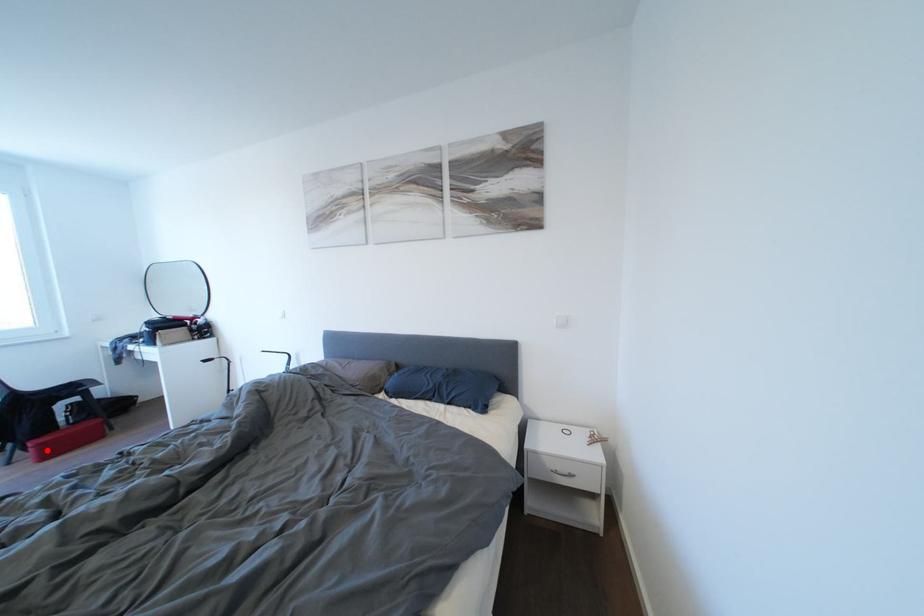
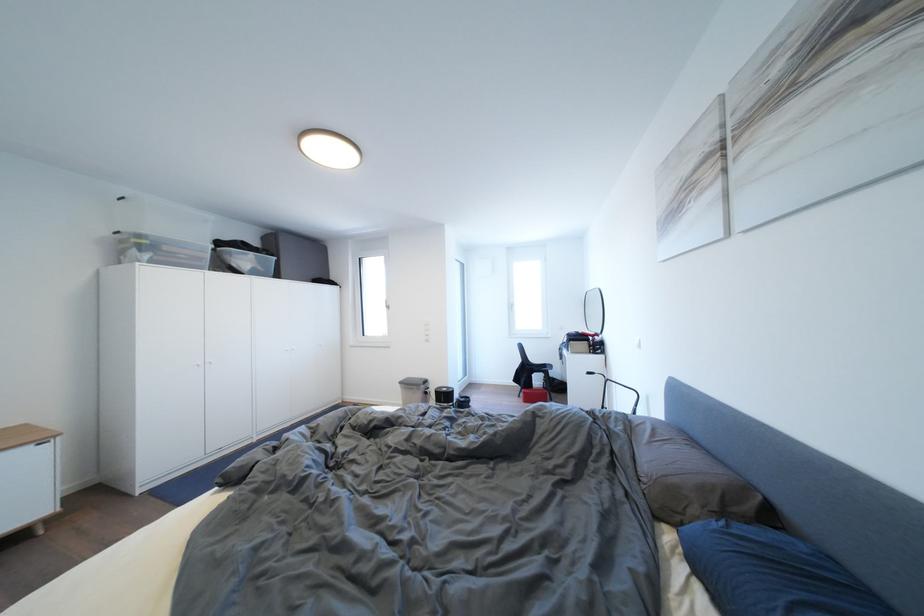
Find the pixel in the second image that matches the highlighted location in the first image.

(532, 398)